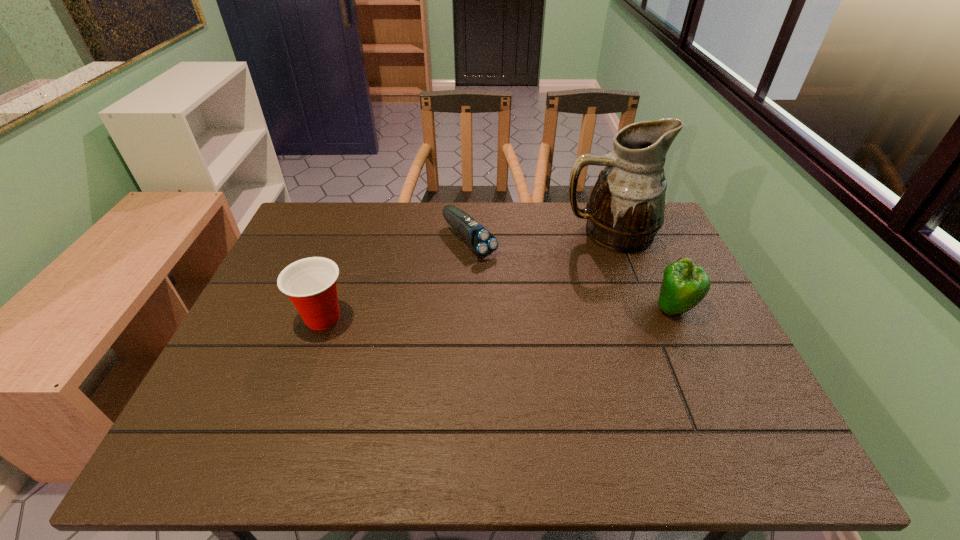
This screenshot has height=540, width=960. What are the coordinates of `free spot between the second shortest object and the tallest object` in the screenshot? It's located at [x=466, y=275].

This screenshot has height=540, width=960. Identify the location of unoccupied position between the second object from left to right and the pitcher. point(539,237).

What are the coordinates of `empty space that is in between the third shortest object and the electric shaver` in the screenshot? It's located at (572, 274).

Find the location of a particular element. free space between the pitcher and the third shortest object is located at coordinates (641, 271).

Image resolution: width=960 pixels, height=540 pixels. Find the location of `free space between the pitcher and the second object from left to right`. free space between the pitcher and the second object from left to right is located at coordinates (539, 237).

Locate which object is the second closest to the bell pepper. Please provide its 2D coordinates. Your answer should be formatted as a tuple, i.e. [(x, y)], where the tuple contains the x and y coordinates of a point satisfying the conditions above.

[(481, 241)]

Locate an element on the screen. This screenshot has width=960, height=540. object that stands as the second closest to the third object from right to left is located at coordinates (311, 283).

Image resolution: width=960 pixels, height=540 pixels. I want to click on free space in the image that satisfies the following two spatial constraints: 1. on the front side of the tallest object; 2. on the right side of the third shortest object, so (636, 308).

The height and width of the screenshot is (540, 960). I want to click on vacant area that satisfies the following two spatial constraints: 1. on the back side of the leftmost object; 2. on the left side of the electric shaver, so tap(350, 240).

At what (x,y) coordinates should I click in order to perform the action: click on vacant space that satisfies the following two spatial constraints: 1. on the back side of the cup; 2. on the right side of the third shortest object. Please return your answer as a coordinate pair (x, y). The width and height of the screenshot is (960, 540). Looking at the image, I should click on (326, 308).